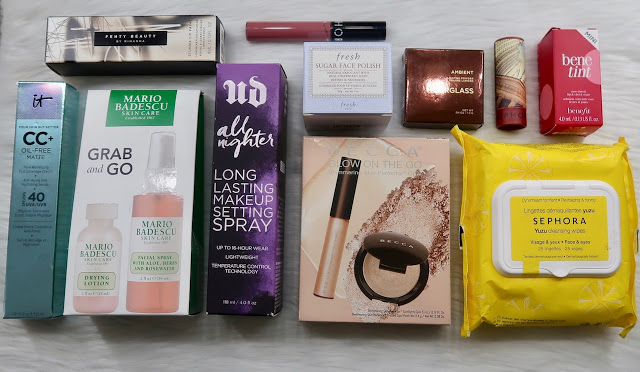
At what (x,y) coordinates should I click in order to perform the action: click on table. Please return your answer as a coordinate pair (x, y). Looking at the image, I should click on (246, 366).